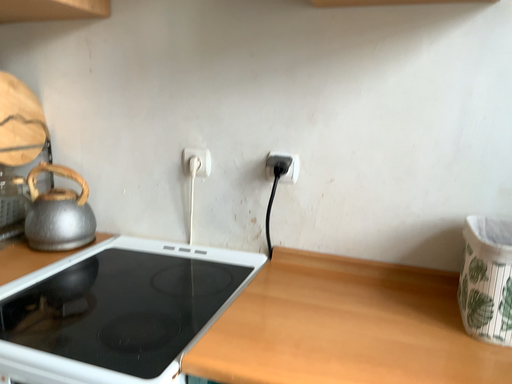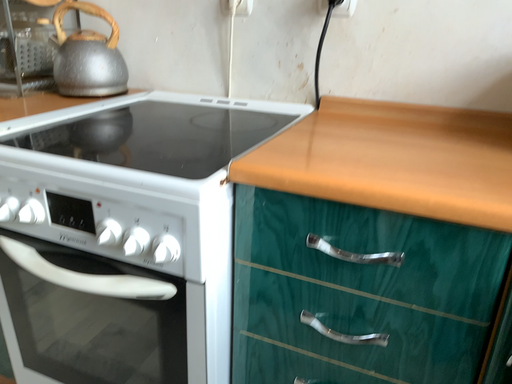
Question: Which way did the camera rotate in the video?

Choices:
 (A) rotated downward
 (B) rotated upward

Answer: (A)